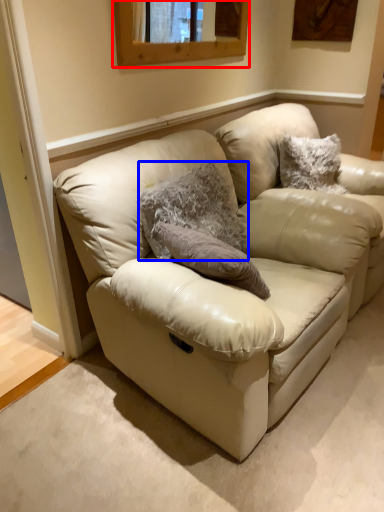
Question: Which point is closer to the camera, window (highlighted by a red box) or animal (highlighted by a blue box)?

Choices:
 (A) window
 (B) animal

Answer: (B)